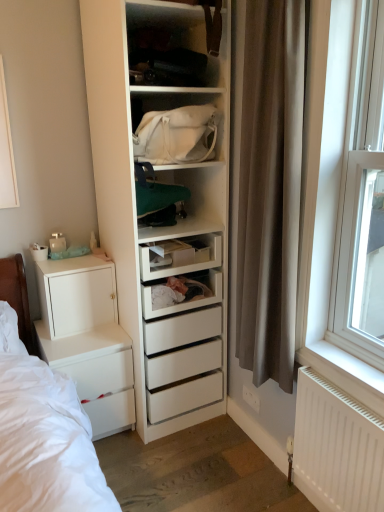
Image resolution: width=384 pixels, height=512 pixels. In order to click on vacant area on top of white matte cabinet at lower left (from a real-world perspective) in this screenshot , I will do `click(68, 260)`.